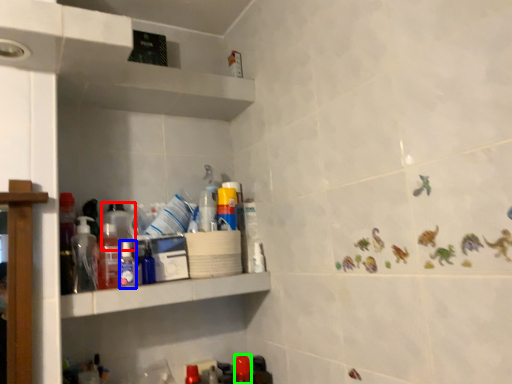
Question: Which is farther away from bottle (highlighted by a red box)? bottle (highlighted by a blue box) or bottle (highlighted by a green box)?

Choices:
 (A) bottle
 (B) bottle

Answer: (B)